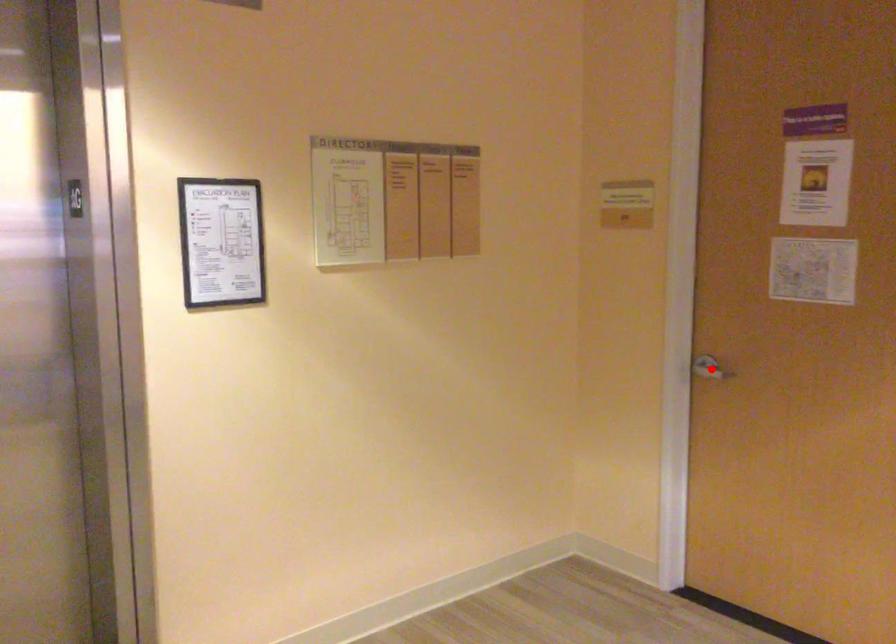
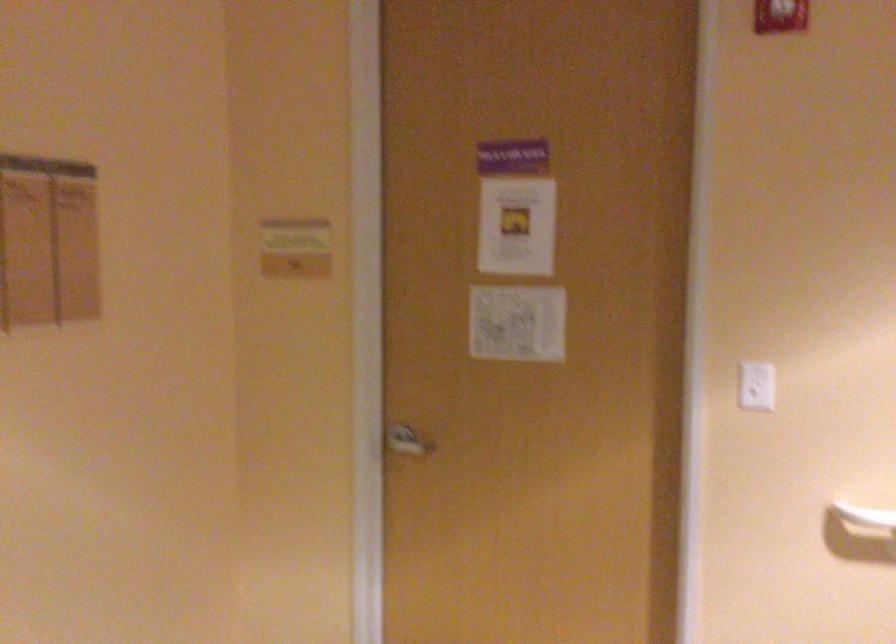
Question: I am providing you with two images of the same scene from different viewpoints. In image1, a red point is highlighted. Considering the same 3D point in image2, which of the following is correct?

Choices:
 (A) It is closer
 (B) It is farther

Answer: (A)